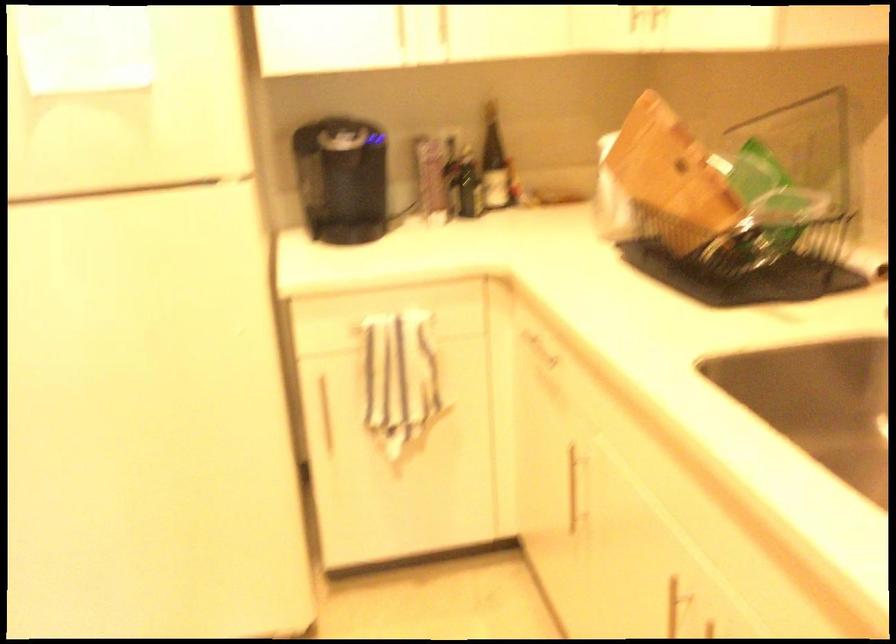
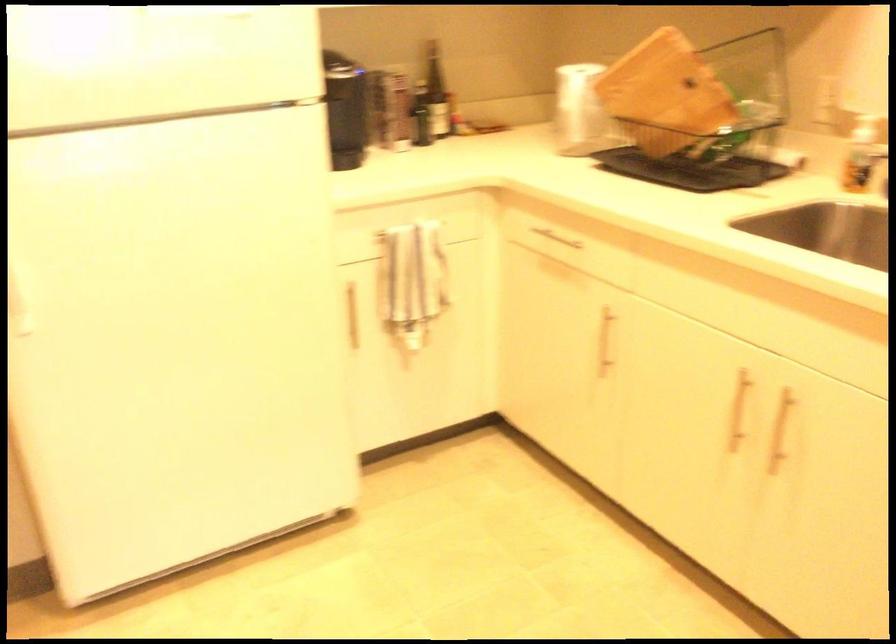
In the second image, find the point that corresponds to pixel 543 351 in the first image.

(554, 238)